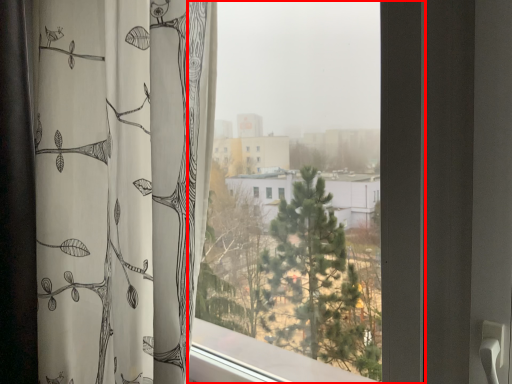
Question: Observing the image, what is the correct spatial positioning of window (annotated by the red box) in reference to curtain?

Choices:
 (A) right
 (B) left

Answer: (A)